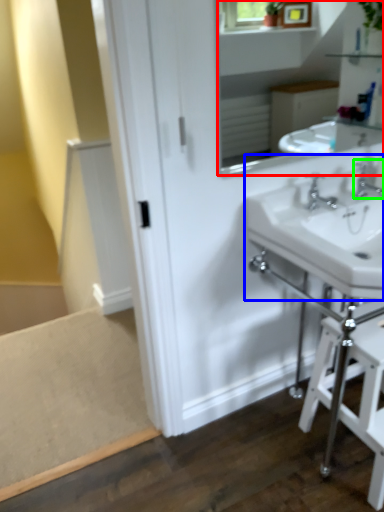
Question: Which object is positioned closest to mirror (highlighted by a red box)? Select from sink (highlighted by a blue box) and tap (highlighted by a green box).

Choices:
 (A) sink
 (B) tap

Answer: (B)